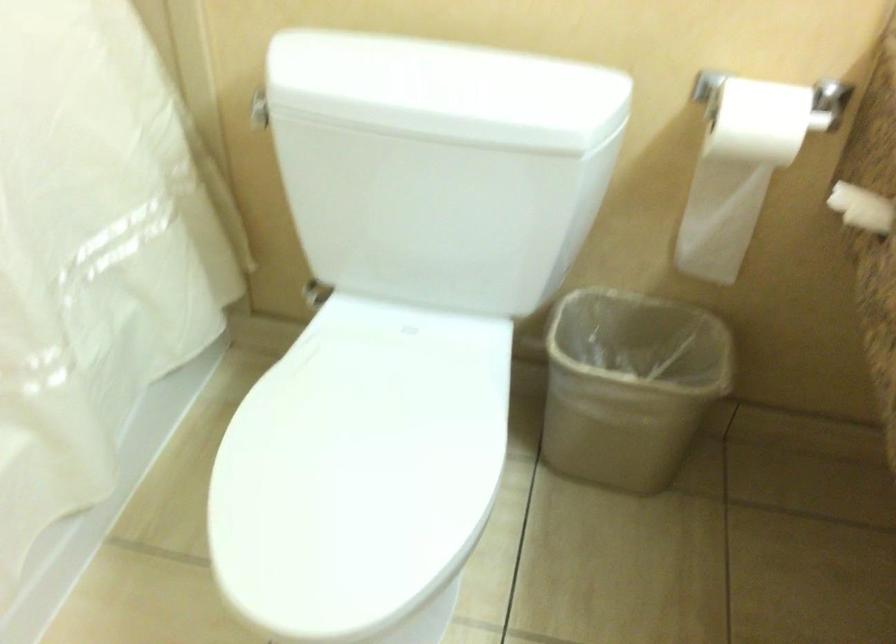
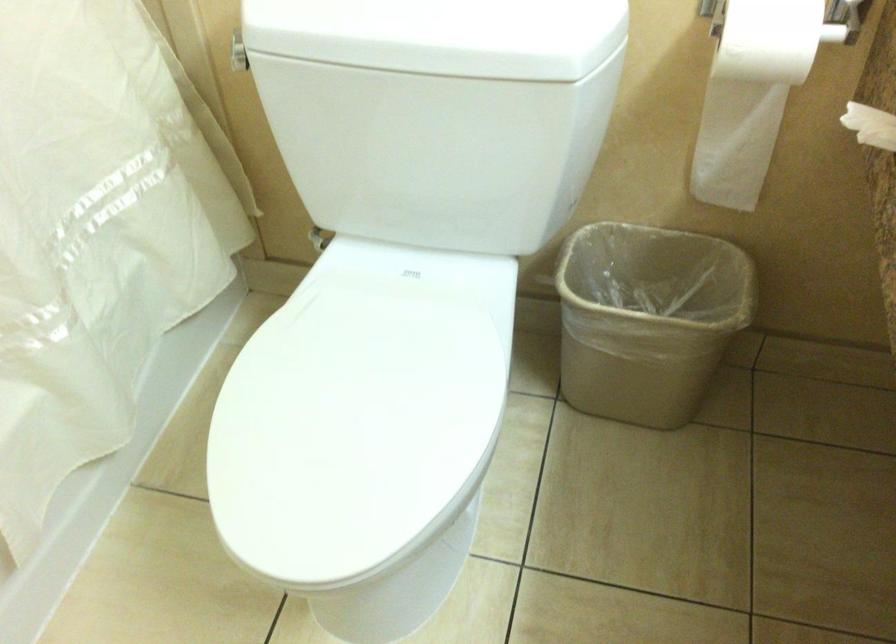
The point at [739,175] is marked in the first image. Where is the corresponding point in the second image?

(752, 93)